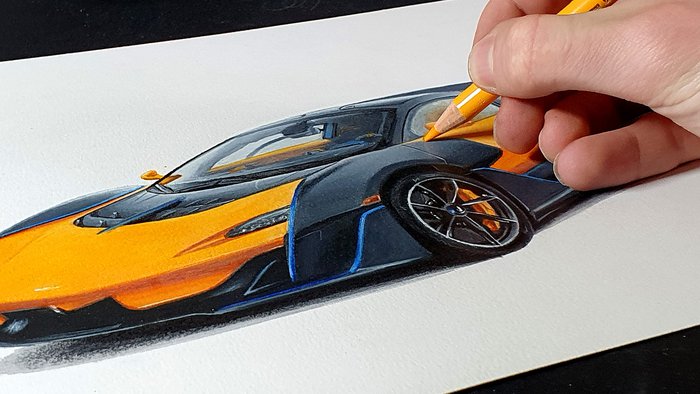
Where is `utensil`? The width and height of the screenshot is (700, 394). utensil is located at coordinates (467, 104).